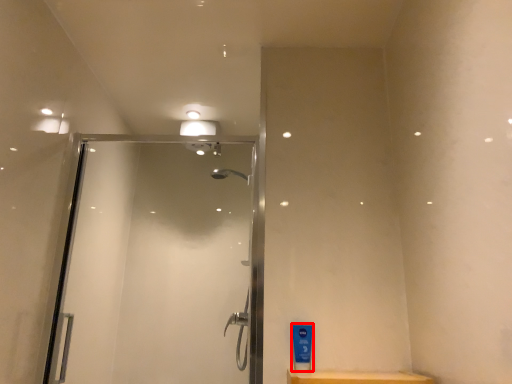
Question: Observing the image, what is the correct spatial positioning of toiletry (annotated by the red box) in reference to screen door?

Choices:
 (A) right
 (B) left

Answer: (A)